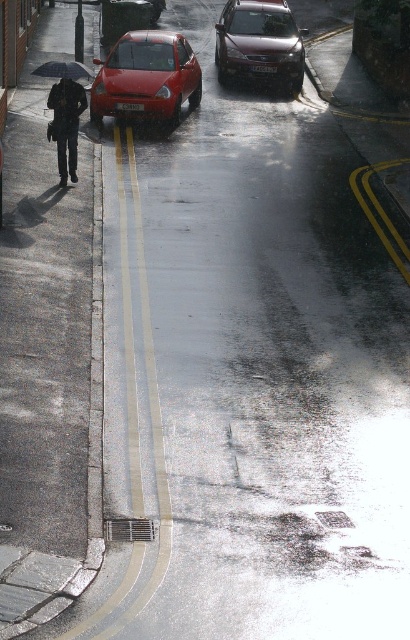
Question: Which point appears closest to the camera in this image?

Choices:
 (A) (286, 36)
 (B) (173, 115)
 (C) (72, 218)
 (D) (84, 67)

Answer: (C)

Question: Does shiny red car at center have a lesser width compared to matte black jacket at left?

Choices:
 (A) no
 (B) yes

Answer: (A)

Question: Is shiny red car at center above shiny metallic car at center?

Choices:
 (A) yes
 (B) no

Answer: (B)

Question: Is gray asphalt pavement at left further to camera compared to shiny red car at center?

Choices:
 (A) yes
 (B) no

Answer: (B)

Question: Which object is positioned closest to the gray asphalt pavement at left?

Choices:
 (A) shiny red car at center
 (B) black matte umbrella at left
 (C) matte black jacket at left
 (D) shiny metallic car at center

Answer: (C)

Question: Which is nearer to the shiny red car at center?

Choices:
 (A) matte black jacket at left
 (B) gray asphalt pavement at left
 (C) black matte umbrella at left

Answer: (C)